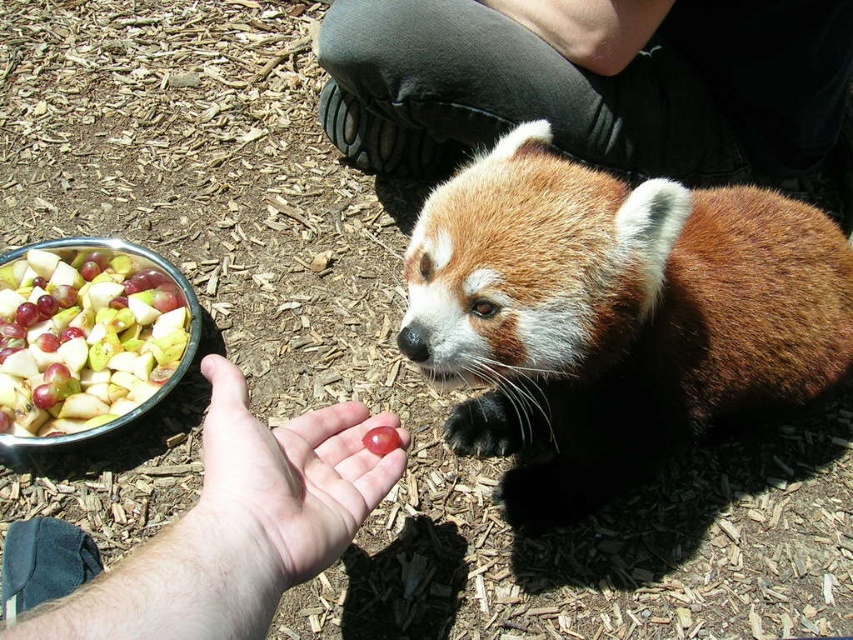
Question: Among these points, which one is farthest from the camera?

Choices:
 (A) (751, 252)
 (B) (107, 284)
 (C) (397, 458)
 (D) (280, 486)

Answer: (B)

Question: Is pink skin palm at center in front of smooth skin palm at center?

Choices:
 (A) yes
 (B) no

Answer: (A)

Question: Can you confirm if pink skin palm at center is positioned to the right of shiny plastic bowl of mixed fruit at lower left?

Choices:
 (A) no
 (B) yes

Answer: (B)

Question: Estimate the real-world distances between objects in this image. Which object is closer to the shiny plastic bowl of mixed fruit at lower left?

Choices:
 (A) smooth skin palm at center
 (B) brown fuzzy red panda at center

Answer: (B)

Question: Observing the image, what is the correct spatial positioning of brown fuzzy red panda at center in reference to smooth skin palm at center?

Choices:
 (A) above
 (B) below

Answer: (A)

Question: Among these points, which one is farthest from the camera?

Choices:
 (A) (103, 595)
 (B) (107, 269)
 (C) (699, 250)

Answer: (B)